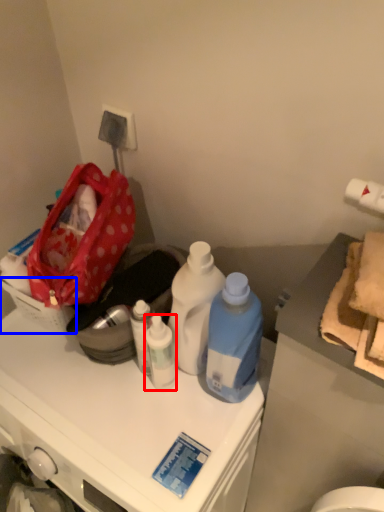
Question: Which object appears farthest to the camera in this image, bottle (highlighted by a red box) or picnic basket (highlighted by a blue box)?

Choices:
 (A) bottle
 (B) picnic basket

Answer: (B)